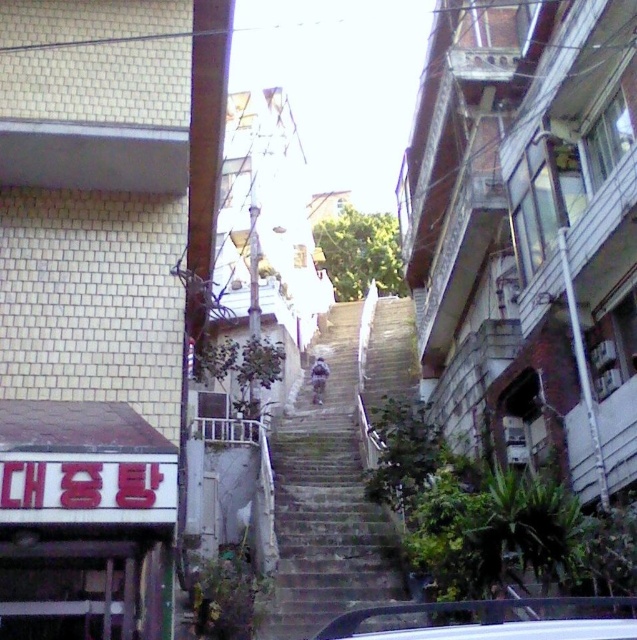
You are a pedestrian trying to cross the gray concrete stairs at center. There is a white glossy car at center approaching from behind. Is there enough space for you to safely step onto the stairs before the car reaches you?

The white glossy car at center is behind the gray concrete stairs at center, so the car is already behind the stairs. Therefore, you can safely step onto the gray concrete stairs at center as the car is not approaching from in front of the stairs.

You are a delivery person trying to park your white glossy car at center in the narrow urban staircase depicted. The white plastic balustrade at center is in the way. Can you park your car without moving the balustrade?

The white glossy car at center occupies less space than the white plastic balustrade at center, so it should be possible to park the car without moving the balustrade as long as there is enough space around the balustrade.